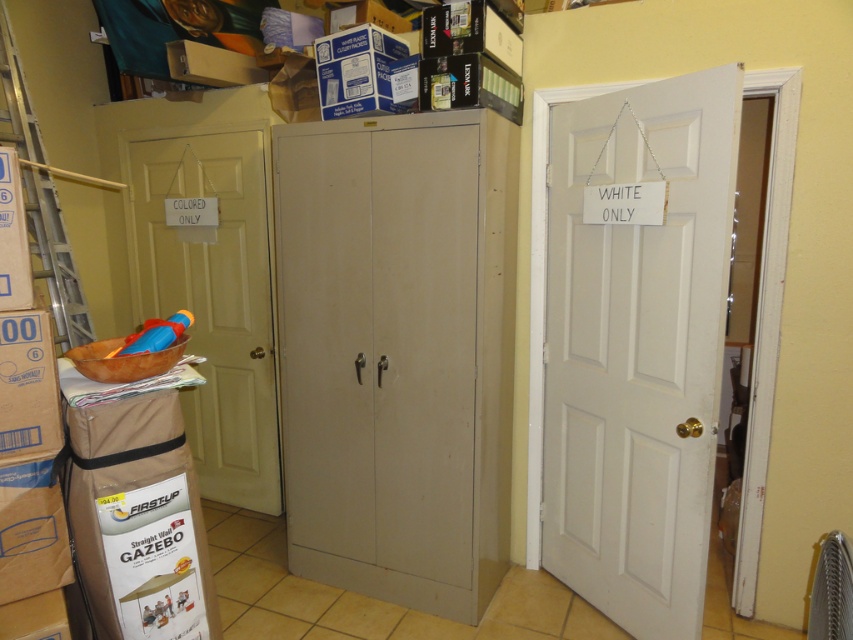
You are standing at the origin point in the image. Which object is located at point (213, 298)?

The matte white door at left is located at point (213, 298).

You are a delivery person with a large package that is 1.8 meters tall. You need to carry it through the white matte door at right. Can you safely pass through the door without tilting the package?

The white matte door at right is 2.00 meters from camera. Since the package is 1.8 meters tall, it is shorter than the door height, so you can safely pass through without tilting it.

Based on the photo, you are standing in the middle of the room and want to exit through the matte white door at left. To reach it, you must pass by the silver metallic ladder at left. Which direction should you move first to avoid the ladder?

Since the matte white door at left is to the right of the silver metallic ladder at left, you should move to the right to avoid the ladder and reach the door.